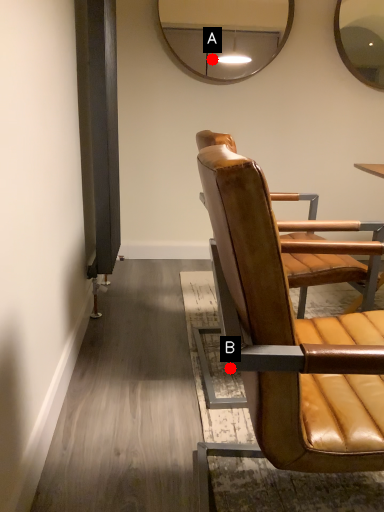
Question: Two points are circled on the image, labeled by A and B beside each circle. Which point is further to the camera?

Choices:
 (A) A is further
 (B) B is further

Answer: (A)